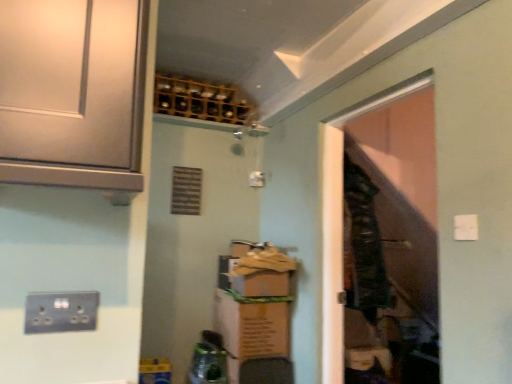
Question: Does wooden wine rack at upper center lie behind dark green fabric laundry at center?

Choices:
 (A) no
 (B) yes

Answer: (B)

Question: Does wooden wine rack at upper center have a greater height compared to dark green fabric laundry at center?

Choices:
 (A) no
 (B) yes

Answer: (A)

Question: Is wooden wine rack at upper center at the right side of dark green fabric laundry at center?

Choices:
 (A) yes
 (B) no

Answer: (B)

Question: Are wooden wine rack at upper center and dark green fabric laundry at center making contact?

Choices:
 (A) yes
 (B) no

Answer: (B)

Question: Is dark green fabric laundry at center inside wooden wine rack at upper center?

Choices:
 (A) yes
 (B) no

Answer: (B)

Question: Does wooden wine rack at upper center have a smaller size compared to dark green fabric laundry at center?

Choices:
 (A) yes
 (B) no

Answer: (A)

Question: Is dark green fabric laundry at center aimed at wooden wine rack at upper center?

Choices:
 (A) yes
 (B) no

Answer: (B)

Question: Considering the relative sizes of dark green fabric laundry at center and wooden wine rack at upper center in the image provided, is dark green fabric laundry at center thinner than wooden wine rack at upper center?

Choices:
 (A) yes
 (B) no

Answer: (B)

Question: Can you confirm if dark green fabric laundry at center is bigger than wooden wine rack at upper center?

Choices:
 (A) yes
 (B) no

Answer: (A)

Question: Are dark green fabric laundry at center and wooden wine rack at upper center far apart?

Choices:
 (A) no
 (B) yes

Answer: (B)

Question: From the image's perspective, is dark green fabric laundry at center on wooden wine rack at upper center?

Choices:
 (A) no
 (B) yes

Answer: (A)

Question: Is dark green fabric laundry at center outside of wooden wine rack at upper center?

Choices:
 (A) yes
 (B) no

Answer: (A)

Question: From a real-world perspective, does metallic socket at lower left sit lower than dark green fabric laundry at center?

Choices:
 (A) yes
 (B) no

Answer: (A)